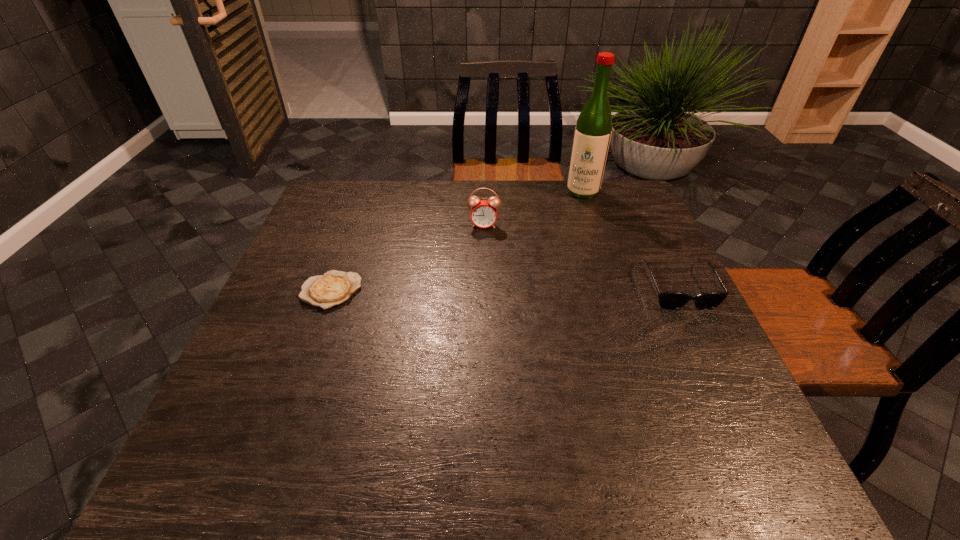
Locate an element on the screen. blank space located on the clock face of the second tallest object is located at coordinates (481, 244).

Identify the location of vacant region located 0.120m on the clock face of the second tallest object. Image resolution: width=960 pixels, height=540 pixels. (480, 255).

Identify the location of blank space located on the clock face of the second tallest object. (476, 286).

Where is `free space located on the label of the liquor`? This screenshot has width=960, height=540. free space located on the label of the liquor is located at coordinates (558, 273).

Identify the location of vacant space situated on the label of the liquor. Image resolution: width=960 pixels, height=540 pixels. (558, 273).

Locate an element on the screen. This screenshot has width=960, height=540. free region located 0.170m on the label of the liquor is located at coordinates (571, 230).

In order to click on alarm clock that is at the far edge in this screenshot , I will do `click(484, 213)`.

The width and height of the screenshot is (960, 540). In order to click on liquor present at the far edge in this screenshot , I will do `click(593, 129)`.

At what (x,y) coordinates should I click in order to perform the action: click on object located in the left edge section of the desktop. Please return your answer as a coordinate pair (x, y). The height and width of the screenshot is (540, 960). Looking at the image, I should click on (333, 288).

Where is `sunglasses at the right edge`? Image resolution: width=960 pixels, height=540 pixels. sunglasses at the right edge is located at coordinates (667, 300).